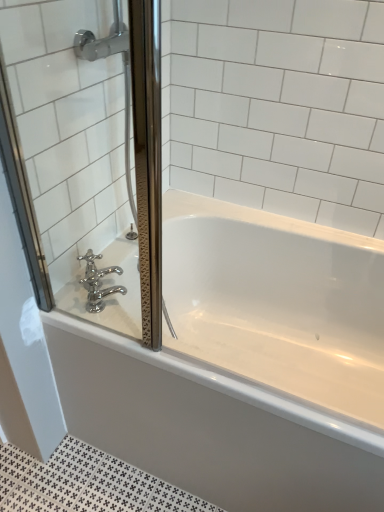
Locate an element on the screen. Image resolution: width=384 pixels, height=512 pixels. vacant area that is in front of polished chrome faucet at lower left is located at coordinates (106, 329).